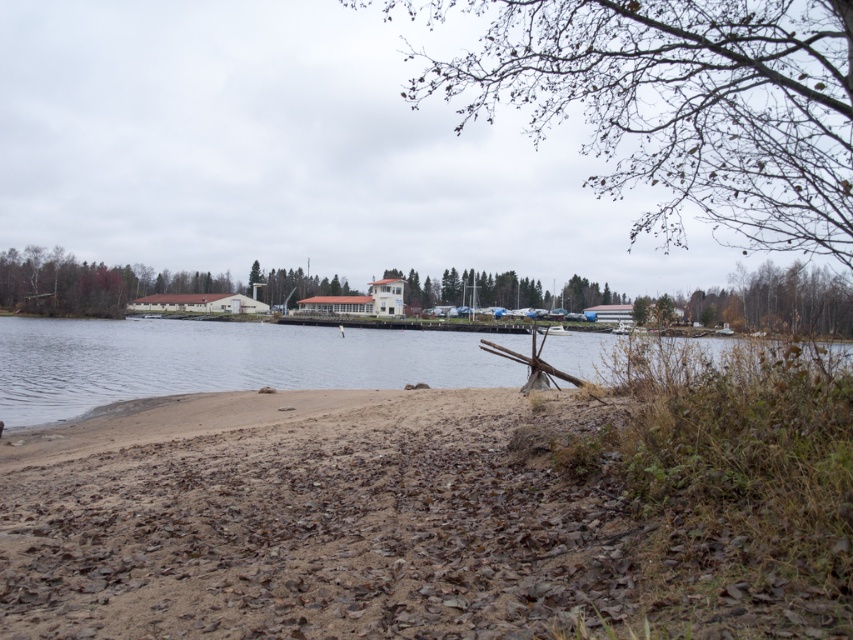
You are an artist trying to paint this lakeside scene. You want to ensure the proportions of the trees match their actual sizes. Given that the bare branches at upper center and the green leafy tree at center are both visible in your painting, which tree should you draw wider in your artwork?

The bare branches at upper center should be drawn wider since their width is larger than the green leafy tree at center according to the description.

You are standing on the lakeside beach and want to take a photo that includes both the clear water at center and the brown textured tree at upper right. Based on their positions, which object should you frame first in your camera viewfinder to ensure both are visible?

You should frame the clear water at center first because it is positioned to the left of the brown textured tree at upper right, so by centering the clear water, the tree will naturally be included on the right side of the frame.